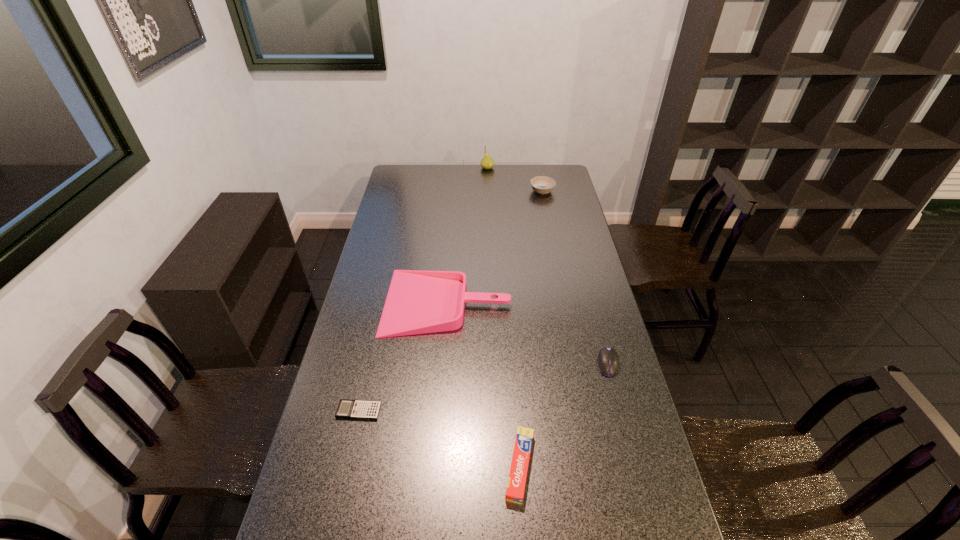
This screenshot has height=540, width=960. Identify the location of vacant area situated on the right of the tallest object. (544, 168).

This screenshot has width=960, height=540. Identify the location of free space located on the right of the fifth object from left to right. (564, 191).

What are the coordinates of `free space located 0.100m on the handle side of the third farthest object` in the screenshot? It's located at (357, 302).

Locate an element on the screen. This screenshot has width=960, height=540. free space located on the front of the fourth farthest object is located at coordinates (629, 444).

The image size is (960, 540). I want to click on vacant space situated on the back of the toothpaste, so click(x=515, y=396).

The image size is (960, 540). I want to click on vacant position located 0.310m on the back of the second nearest object, so click(378, 324).

At what (x,y) coordinates should I click in order to perform the action: click on pear that is at the far edge. Please return your answer as a coordinate pair (x, y). Looking at the image, I should click on (487, 162).

The width and height of the screenshot is (960, 540). I want to click on bowl that is positioned at the far edge, so click(541, 184).

Locate an element on the screen. The image size is (960, 540). dustpan that is at the left edge is located at coordinates (418, 302).

Where is `calculator at the left edge`? calculator at the left edge is located at coordinates (x=354, y=409).